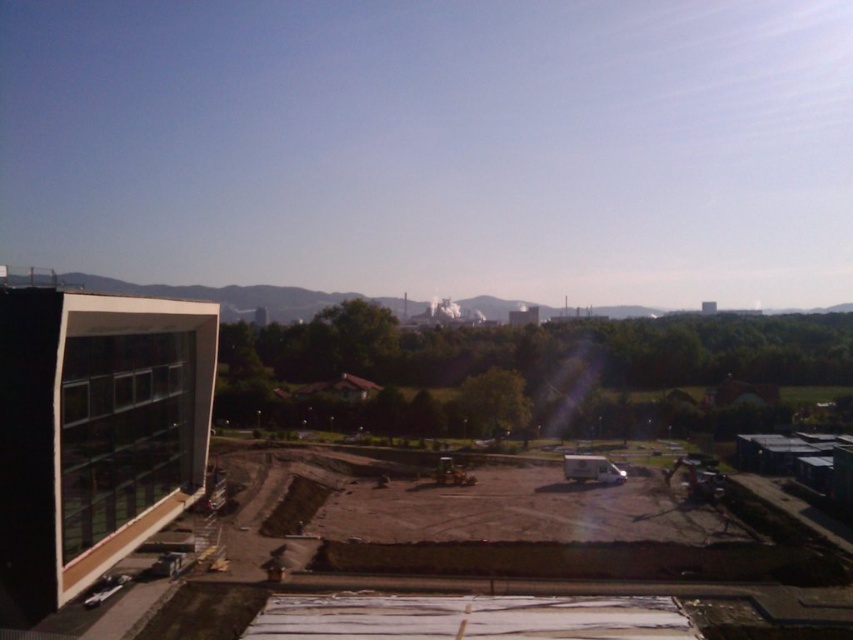
Which is in front, point (200, 442) or point (106, 406)?

Point (106, 406) is in front.

In the scene shown: Who is more distant from viewer, (479, 401) or (15, 314)?

Positioned behind is point (479, 401).

Locate an element on the screen. brown dirt at center is located at coordinates (97, 429).